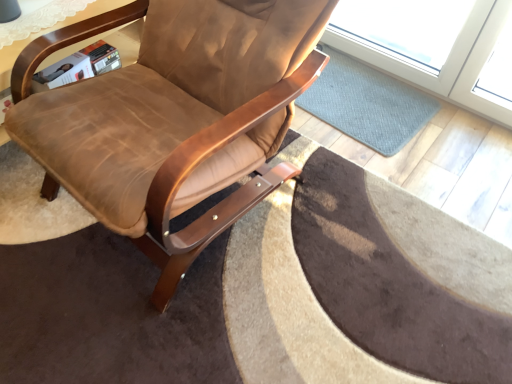
Question: Is blue textured mat at center completely or partially outside of brown leather chair at center?

Choices:
 (A) no
 (B) yes

Answer: (B)

Question: Can you confirm if blue textured mat at center is taller than brown leather chair at center?

Choices:
 (A) yes
 (B) no

Answer: (B)

Question: Is the position of blue textured mat at center more distant than that of brown leather chair at center?

Choices:
 (A) yes
 (B) no

Answer: (A)

Question: Could you tell me if blue textured mat at center is facing brown leather chair at center?

Choices:
 (A) no
 (B) yes

Answer: (A)

Question: Can you confirm if blue textured mat at center is thinner than brown leather chair at center?

Choices:
 (A) no
 (B) yes

Answer: (B)

Question: Considering the relative sizes of blue textured mat at center and brown leather chair at center in the image provided, is blue textured mat at center bigger than brown leather chair at center?

Choices:
 (A) yes
 (B) no

Answer: (B)

Question: Considering the relative positions of brown leather chair at center and blue textured mat at center in the image provided, is brown leather chair at center to the right of blue textured mat at center from the viewer's perspective?

Choices:
 (A) no
 (B) yes

Answer: (A)

Question: Is brown leather chair at center positioned behind blue textured mat at center?

Choices:
 (A) no
 (B) yes

Answer: (A)

Question: Is brown leather chair at center shorter than blue textured mat at center?

Choices:
 (A) yes
 (B) no

Answer: (B)

Question: From the image's perspective, would you say brown leather chair at center is shown under blue textured mat at center?

Choices:
 (A) no
 (B) yes

Answer: (B)

Question: Considering the relative sizes of brown leather chair at center and blue textured mat at center in the image provided, is brown leather chair at center taller than blue textured mat at center?

Choices:
 (A) yes
 (B) no

Answer: (A)

Question: From a real-world perspective, is brown leather chair at center on top of blue textured mat at center?

Choices:
 (A) no
 (B) yes

Answer: (B)

Question: From the image's perspective, is wooden table at upper left over blue textured mat at center?

Choices:
 (A) yes
 (B) no

Answer: (B)